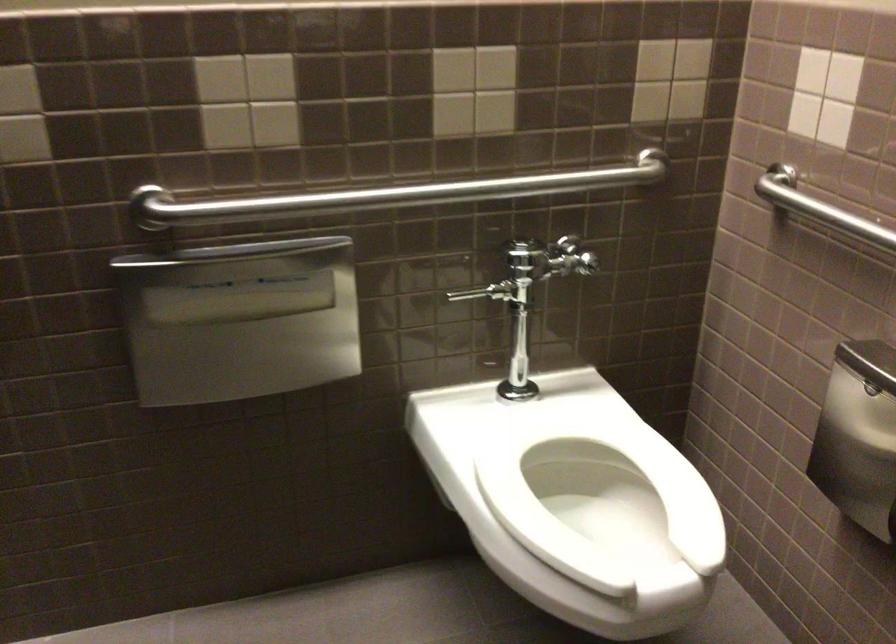
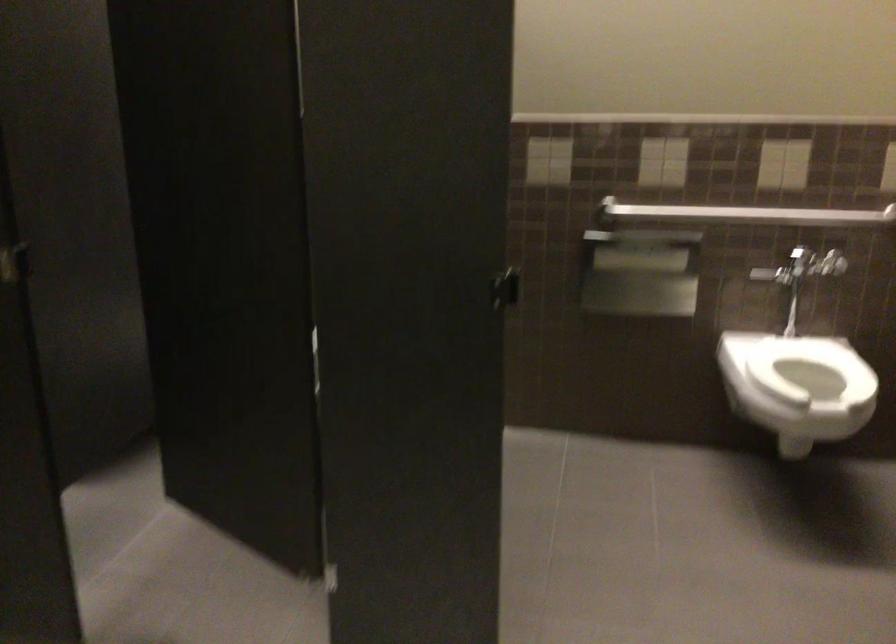
In the second image, find the point that corresponds to the point at 412,202 in the first image.

(745, 214)